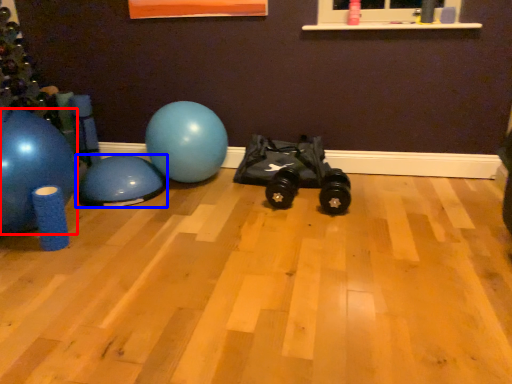
Question: Which point is closer to the camera, ball (highlighted by a red box) or ball (highlighted by a blue box)?

Choices:
 (A) ball
 (B) ball

Answer: (A)